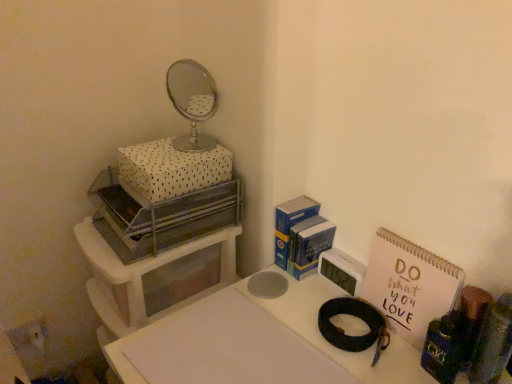
Question: In the image, is pink paper notebook at right on the left side or the right side of white matte table at center?

Choices:
 (A) left
 (B) right

Answer: (B)

Question: Considering the positions of pink paper notebook at right and white matte table at center in the image, is pink paper notebook at right taller or shorter than white matte table at center?

Choices:
 (A) tall
 (B) short

Answer: (B)

Question: Based on their relative distances, which object is farther from the white plastic clock at center-right, which is the 1th appliance from back to front?

Choices:
 (A) shiny metallic magnifying glass at upper center
 (B) white plastic storage unit at left
 (C) wooden cylindrical container at right, acting as the third appliance starting from the left
 (D) metallic silver tray at upper left, which ranks as the 2th appliance in back-to-front order
 (E) white matte table at center

Answer: (B)

Question: Which is nearer to the shiny metallic magnifying glass at upper center?

Choices:
 (A) white plastic storage unit at left
 (B) white plastic clock at center-right, the second appliance viewed from the right
 (C) white dotted fabric box at upper left
 (D) white matte table at center
 (E) metallic silver tray at upper left, the 1th appliance when ordered from left to right

Answer: (B)